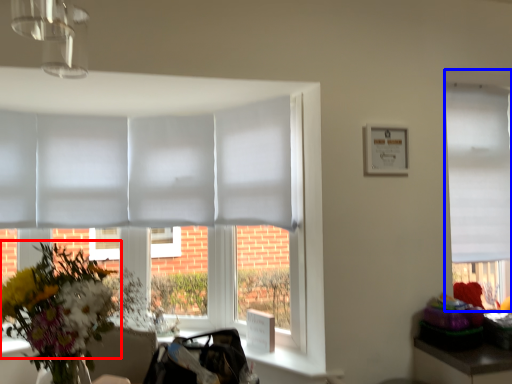
Question: Which point is further to the camera, flower (highlighted by a red box) or window (highlighted by a blue box)?

Choices:
 (A) flower
 (B) window

Answer: (B)